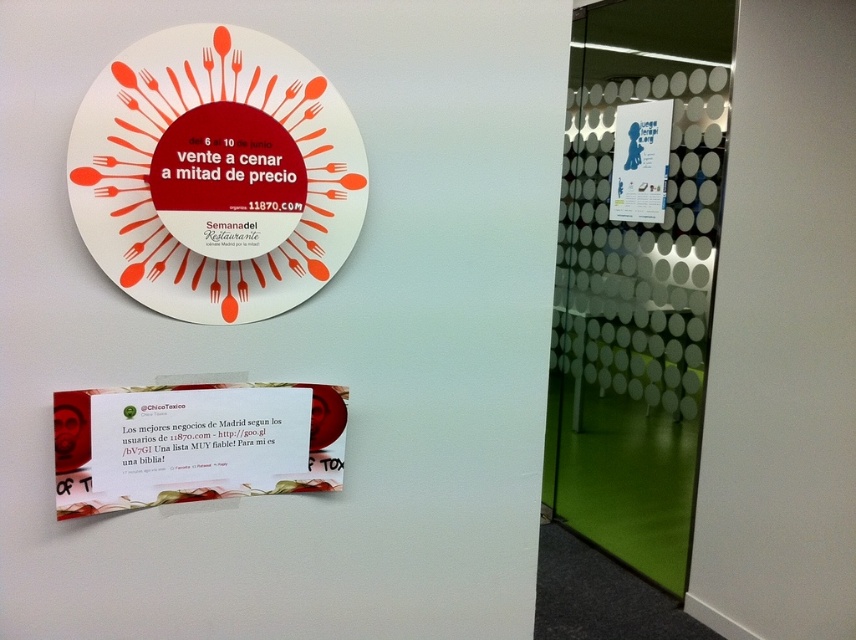
Question: Is white paper plate at upper center further to camera compared to white paper poster at upper right?

Choices:
 (A) yes
 (B) no

Answer: (B)

Question: Which point is farther from the camera taking this photo?

Choices:
 (A) (111, 456)
 (B) (623, 122)

Answer: (B)

Question: Is white paper at center closer to the viewer compared to white paper poster at upper right?

Choices:
 (A) no
 (B) yes

Answer: (B)

Question: Among these objects, which one is farthest from the camera?

Choices:
 (A) white paper at center
 (B) white paper plate at upper center
 (C) white paper poster at upper right

Answer: (C)

Question: Estimate the real-world distances between objects in this image. Which object is closer to the white paper at center?

Choices:
 (A) white paper poster at upper right
 (B) white paper plate at upper center

Answer: (B)

Question: Observing the image, what is the correct spatial positioning of white paper at center in reference to white paper poster at upper right?

Choices:
 (A) right
 (B) left

Answer: (B)